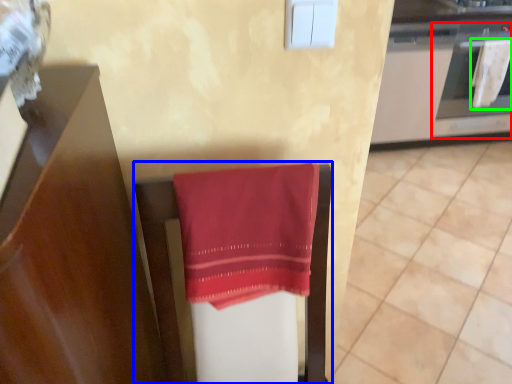
Question: Which object is positioned farthest from oven (highlighted by a red box)? Select from furniture (highlighted by a blue box) and beach towel (highlighted by a green box).

Choices:
 (A) furniture
 (B) beach towel

Answer: (A)